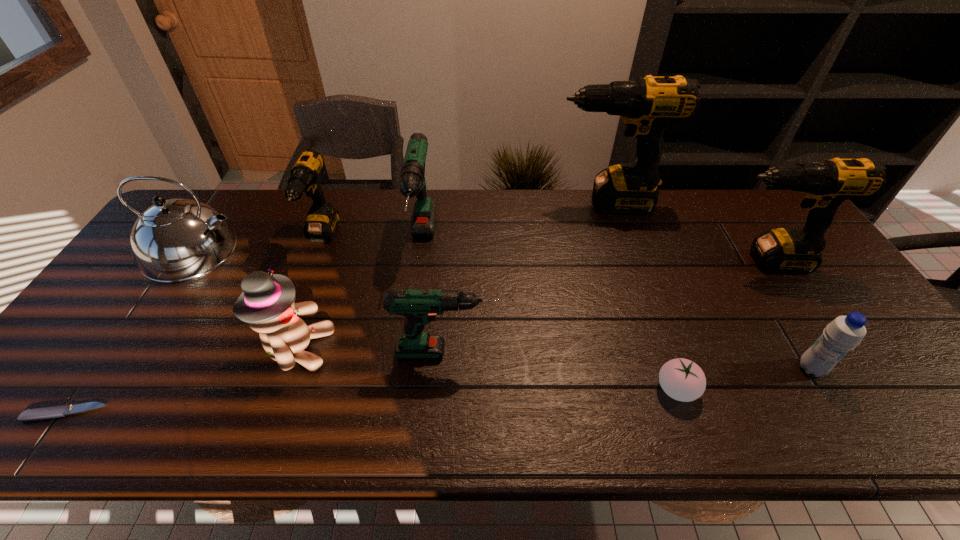
I want to click on tomato that is at the near edge, so click(x=683, y=380).

Identify the location of steak knife that is at the near edge. (38, 414).

This screenshot has width=960, height=540. In order to click on kettle at the left edge in this screenshot , I will do `click(175, 240)`.

Where is `steak knife at the left edge`? steak knife at the left edge is located at coordinates (38, 414).

Identify the location of object that is at the right edge. This screenshot has height=540, width=960. (825, 184).

Locate an element on the screen. object located in the far left corner section of the desktop is located at coordinates (175, 240).

In order to click on object that is at the near left corner in this screenshot , I will do `click(38, 414)`.

At what (x,y) coordinates should I click in order to perform the action: click on vacant region at the far edge. Please return your answer as a coordinate pair (x, y). The image size is (960, 540). Looking at the image, I should click on (692, 198).

Locate an element on the screen. This screenshot has width=960, height=540. vacant space at the near edge of the desktop is located at coordinates (410, 425).

Identify the location of free region at the left edge of the desktop. 103,382.